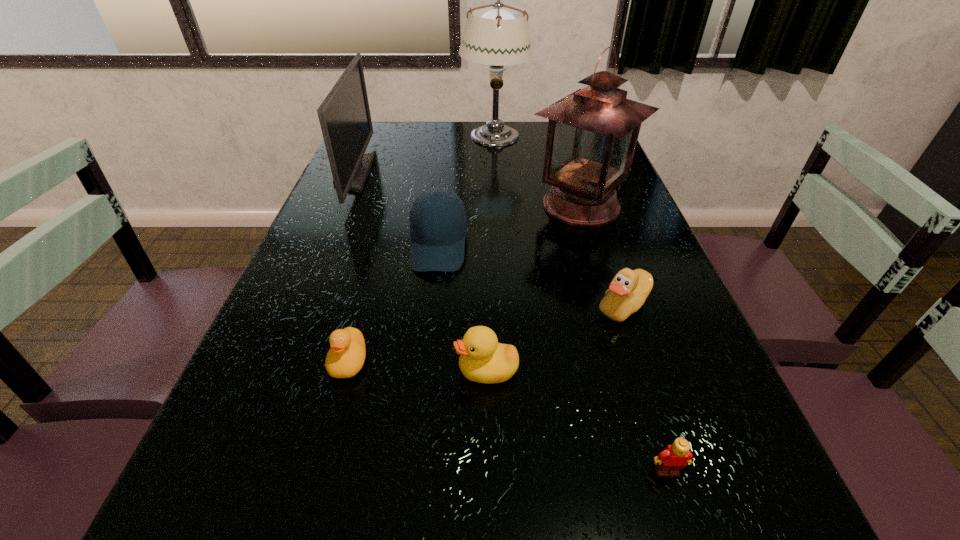
The image size is (960, 540). I want to click on Lego, so click(673, 458).

You are a GUI agent. You are given a task and a screenshot of the screen. Output one action in this format:
    pyautogui.click(x=<x>, y=<y>)
    Task: Click on the free spot located on the lampshade of the lampshade
    
    Given the screenshot: What is the action you would take?
    [x=497, y=212]

Image resolution: width=960 pixels, height=540 pixels. Find the location of `free point located 0.300m on the left of the oil lamp`. free point located 0.300m on the left of the oil lamp is located at coordinates (416, 206).

Where is `vacant region located 0.190m on the screen side of the monitor`? This screenshot has width=960, height=540. vacant region located 0.190m on the screen side of the monitor is located at coordinates (431, 173).

Locate an element on the screen. The width and height of the screenshot is (960, 540). free region located 0.140m on the front-facing side of the baseball cap is located at coordinates (429, 324).

Where is `vacant space located 0.180m at the beak of the farthest duck`? The width and height of the screenshot is (960, 540). vacant space located 0.180m at the beak of the farthest duck is located at coordinates (510, 306).

This screenshot has height=540, width=960. I want to click on free space located at the beak of the farthest duck, so click(495, 306).

At what (x,y) coordinates should I click in order to perform the action: click on vacant space situated 0.170m at the beak of the farthest duck. Please return your answer as a coordinate pair (x, y). The image size is (960, 540). Looking at the image, I should click on (515, 306).

Identify the location of vacant area located 0.150m at the beak of the second duck from left to right. The height and width of the screenshot is (540, 960). (373, 370).

The height and width of the screenshot is (540, 960). What are the coordinates of `free spot located at the beak of the second duck from left to right` in the screenshot? It's located at (279, 370).